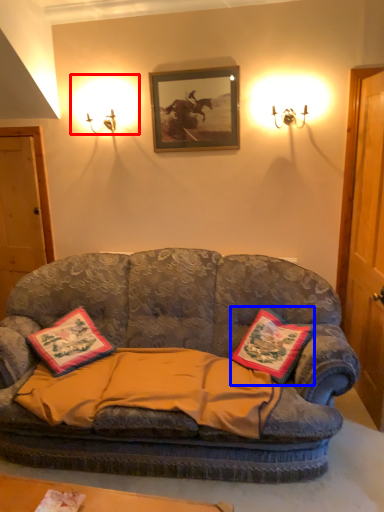
Question: Which point is further to the camera, lighting (highlighted by a red box) or pillow (highlighted by a blue box)?

Choices:
 (A) lighting
 (B) pillow

Answer: (A)